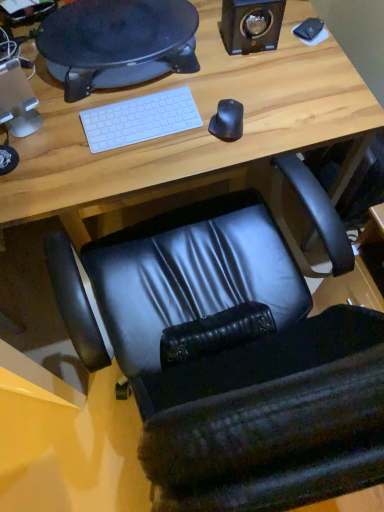
Find the location of a particular element. The height and width of the screenshot is (512, 384). free space that is in between black rubber mouse at center and white matte keyboard at center is located at coordinates (176, 138).